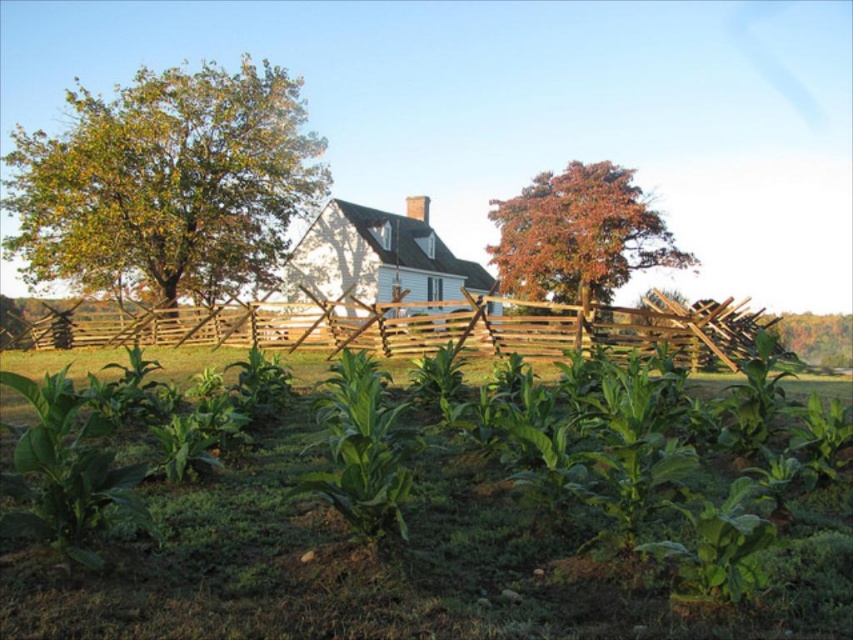
You are a farmer checking the growth of your crops. You notice the green leafy plants at center and the wooden fence at center. Which one is narrower in width?

The green leafy plants at center are narrower in width than the wooden fence at center.

You are standing at the point with coordinates (422,326) in the image. What object are you directly facing?

The point at (422,326) indicates the wooden fence at center, so you are directly facing the wooden fence at center.

You are standing in the field of tobacco plants and want to walk towards the wooden fence at center. Based on the coordinates provided, in which direction should you head?

The wooden fence at center is located at coordinates point (422, 326), so you should head towards the center of the image to reach it.